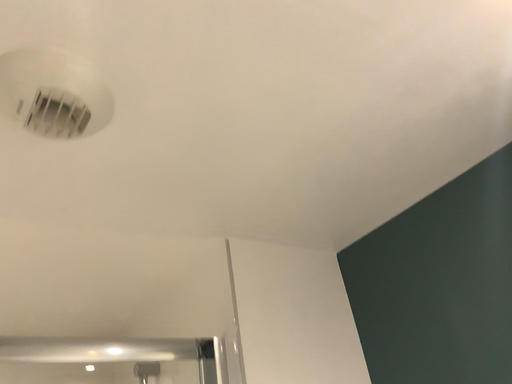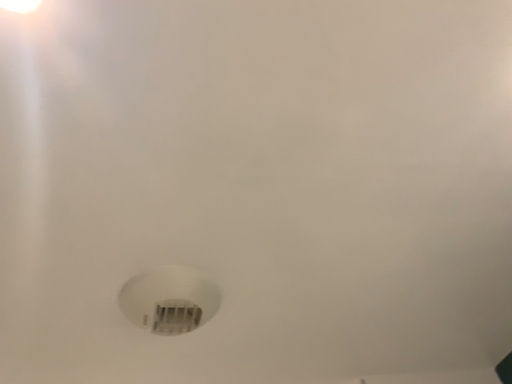
Question: Which way did the camera rotate in the video?

Choices:
 (A) rotated upward
 (B) rotated downward

Answer: (A)